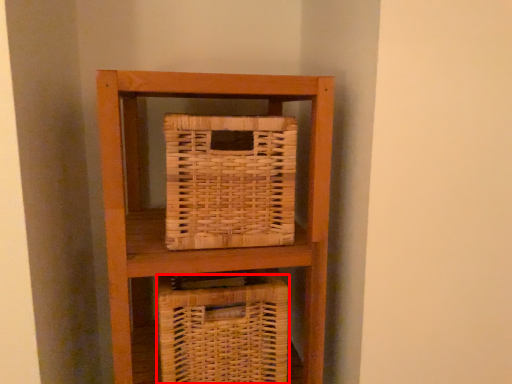
Question: From the image's perspective, what is the correct spatial relationship of basket (annotated by the red box) in relation to picnic basket?

Choices:
 (A) above
 (B) below

Answer: (B)